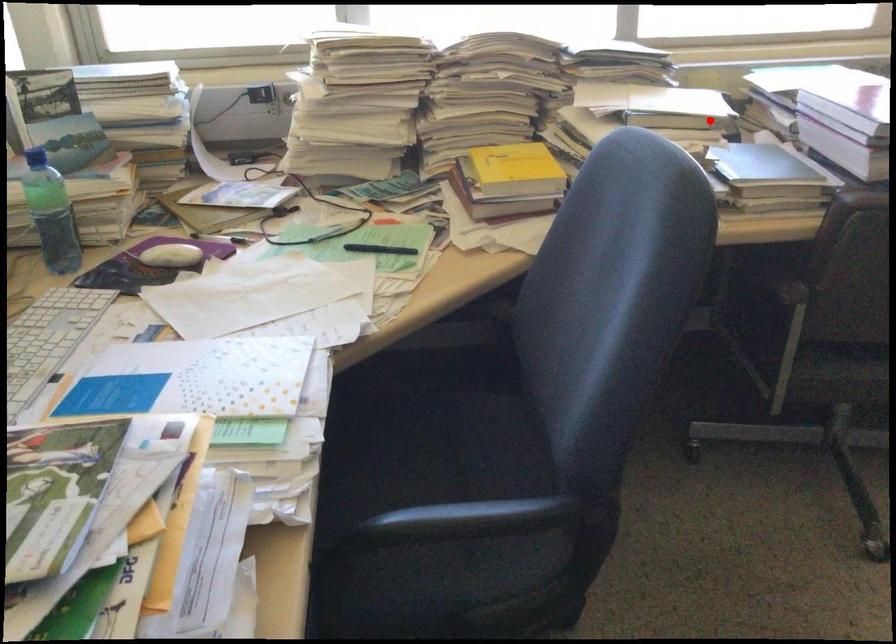
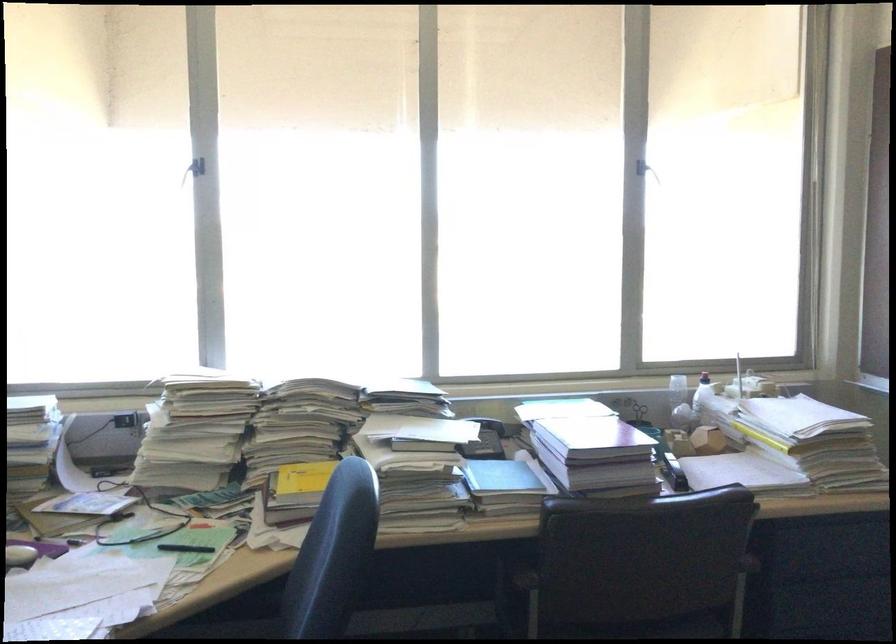
In the second image, find the point that corresponds to the highlighted location in the first image.

(485, 440)